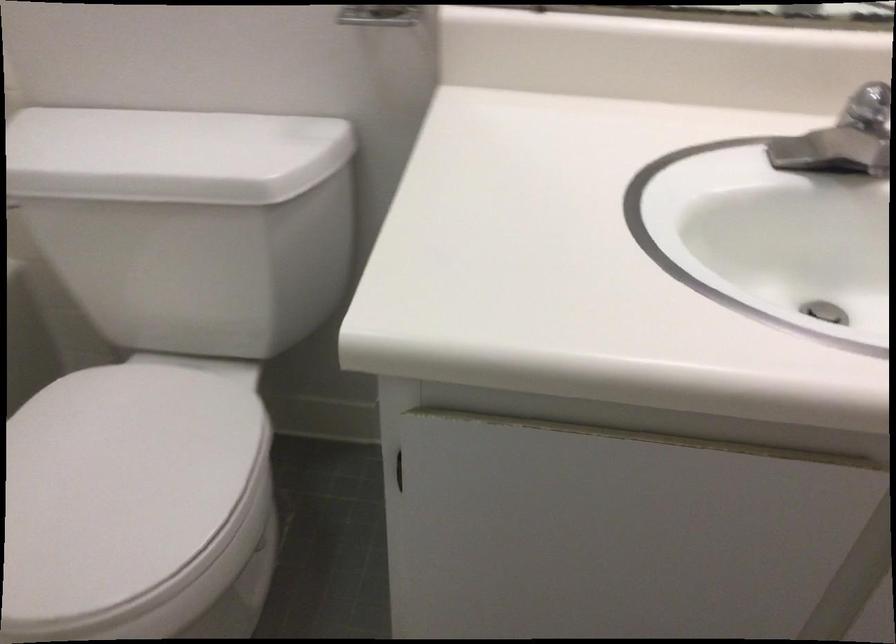
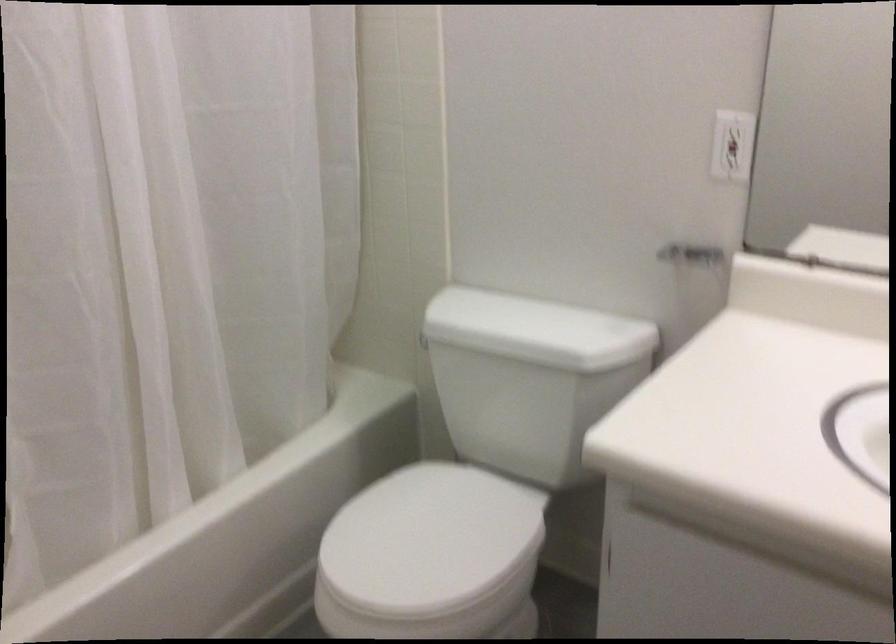
Question: The first image is from the beginning of the video and the second image is from the end. How did the camera likely rotate when shooting the video?

Choices:
 (A) Left
 (B) Right
 (C) Up
 (D) Down

Answer: (A)